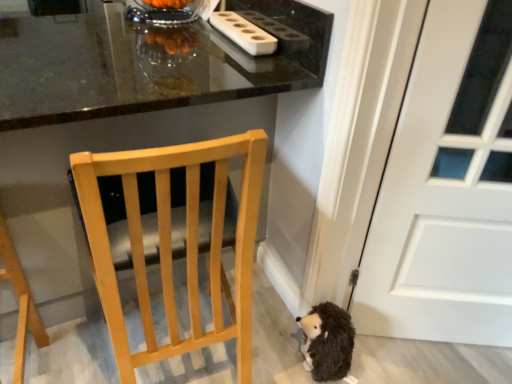
Question: Would you say white plastic holder at upper center is outside white matte door at right?

Choices:
 (A) yes
 (B) no

Answer: (A)

Question: From a real-world perspective, is white plastic holder at upper center on top of white matte door at right?

Choices:
 (A) yes
 (B) no

Answer: (A)

Question: Can you confirm if white plastic holder at upper center is positioned to the left of white matte door at right?

Choices:
 (A) no
 (B) yes

Answer: (B)

Question: Considering the relative positions of white plastic holder at upper center and white matte door at right in the image provided, is white plastic holder at upper center behind white matte door at right?

Choices:
 (A) yes
 (B) no

Answer: (A)

Question: From the image's perspective, is white plastic holder at upper center on top of white matte door at right?

Choices:
 (A) no
 (B) yes

Answer: (B)

Question: Is white plastic holder at upper center wider than white matte door at right?

Choices:
 (A) yes
 (B) no

Answer: (B)

Question: Considering the relative sizes of light wood chair at center and white plastic holder at upper center in the image provided, is light wood chair at center bigger than white plastic holder at upper center?

Choices:
 (A) no
 (B) yes

Answer: (B)

Question: Is light wood chair at center turned away from white plastic holder at upper center?

Choices:
 (A) no
 (B) yes

Answer: (A)

Question: From a real-world perspective, is light wood chair at center on white plastic holder at upper center?

Choices:
 (A) no
 (B) yes

Answer: (A)

Question: Does light wood chair at center have a smaller size compared to white plastic holder at upper center?

Choices:
 (A) yes
 (B) no

Answer: (B)

Question: From the image's perspective, does light wood chair at center appear lower than white plastic holder at upper center?

Choices:
 (A) yes
 (B) no

Answer: (A)

Question: Does light wood chair at center come in front of white plastic holder at upper center?

Choices:
 (A) yes
 (B) no

Answer: (A)

Question: From the image's perspective, does light wood chair at center appear lower than glossy black table at upper center?

Choices:
 (A) yes
 (B) no

Answer: (A)